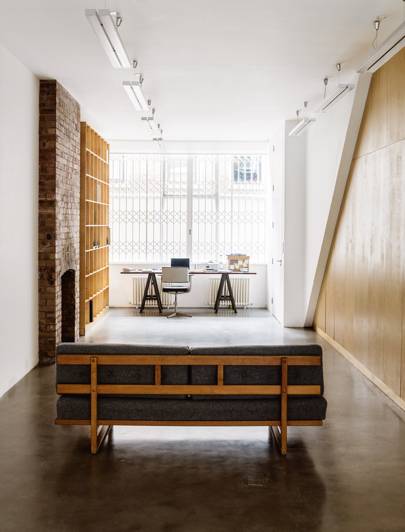
Locate an element on the screen. This screenshot has width=405, height=532. hanging ceiling lights is located at coordinates (113, 53), (136, 98), (151, 124), (160, 144), (303, 124), (339, 95), (383, 56).